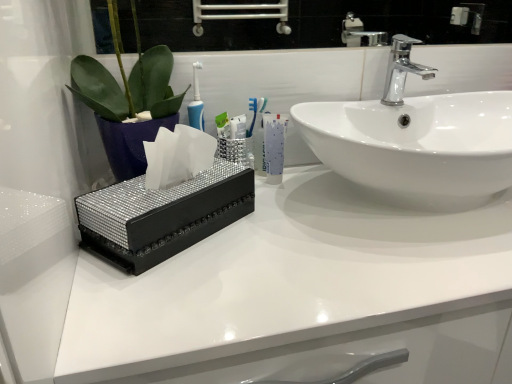
Question: Does polished chrome faucet at upper right have a lesser width compared to white glossy mouthwash at center?

Choices:
 (A) yes
 (B) no

Answer: (B)

Question: Is polished chrome faucet at upper right outside of white glossy mouthwash at center?

Choices:
 (A) yes
 (B) no

Answer: (A)

Question: Can you confirm if polished chrome faucet at upper right is smaller than white glossy mouthwash at center?

Choices:
 (A) no
 (B) yes

Answer: (A)

Question: Does polished chrome faucet at upper right have a larger size compared to white glossy mouthwash at center?

Choices:
 (A) no
 (B) yes

Answer: (B)

Question: Is polished chrome faucet at upper right to the left of white glossy mouthwash at center from the viewer's perspective?

Choices:
 (A) yes
 (B) no

Answer: (B)

Question: Is the position of polished chrome faucet at upper right less distant than that of white glossy mouthwash at center?

Choices:
 (A) yes
 (B) no

Answer: (A)

Question: Is white glossy sink at center turned away from sparkly black tissue box at center?

Choices:
 (A) yes
 (B) no

Answer: (B)

Question: Is sparkly black tissue box at center inside white glossy sink at center?

Choices:
 (A) no
 (B) yes

Answer: (A)

Question: Is white glossy sink at center smaller than sparkly black tissue box at center?

Choices:
 (A) no
 (B) yes

Answer: (A)

Question: From the image's perspective, is white glossy sink at center on sparkly black tissue box at center?

Choices:
 (A) no
 (B) yes

Answer: (B)

Question: Is white glossy sink at center oriented towards sparkly black tissue box at center?

Choices:
 (A) yes
 (B) no

Answer: (B)

Question: Would you consider white glossy sink at center to be distant from sparkly black tissue box at center?

Choices:
 (A) yes
 (B) no

Answer: (B)

Question: From the image's perspective, is white glossy sink at center over polished chrome faucet at upper right?

Choices:
 (A) yes
 (B) no

Answer: (B)